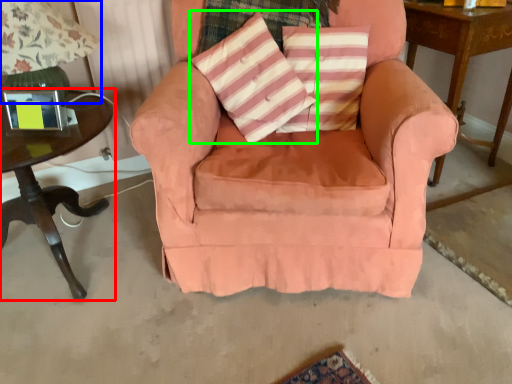
Question: Which object is the farthest from table (highlighted by a red box)? Choose among these: table lamp (highlighted by a blue box) or throw pillow (highlighted by a green box).

Choices:
 (A) table lamp
 (B) throw pillow

Answer: (B)